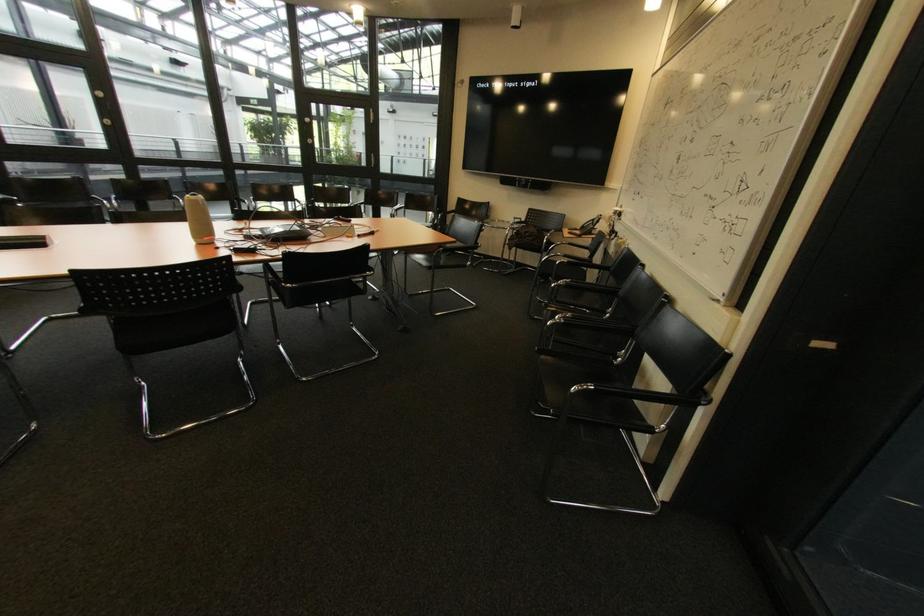
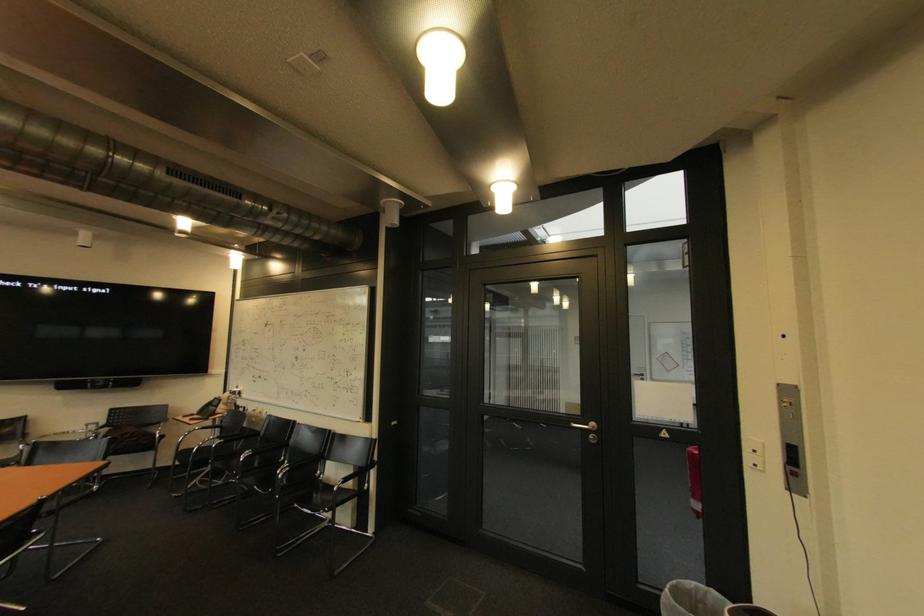
Find the pixel in the second image that matches (x=581, y=390) in the first image.

(343, 488)